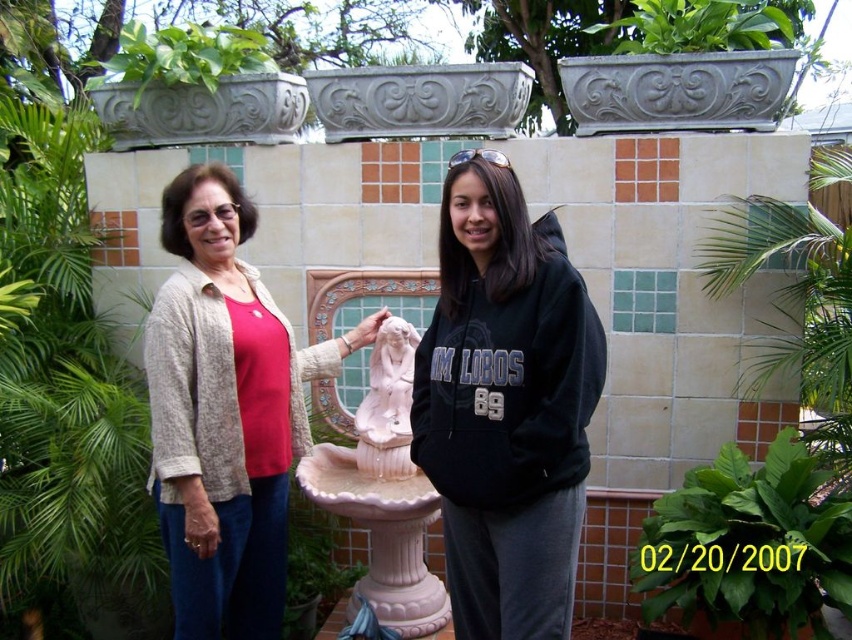
Question: Does green leafy plant at upper left have a smaller size compared to white marble statue at center?

Choices:
 (A) yes
 (B) no

Answer: (B)

Question: Can you confirm if black fleece sweatshirt at center is positioned to the left of matte beige cardigan at left?

Choices:
 (A) yes
 (B) no

Answer: (B)

Question: Which point is closer to the camera taking this photo?

Choices:
 (A) (250, 317)
 (B) (671, 496)

Answer: (A)

Question: Which point is farther from the camera taking this photo?

Choices:
 (A) 743,44
 (B) 233,49
 (C) 446,227
 (D) 400,365

Answer: (B)

Question: Does black fleece sweatshirt at center have a greater width compared to matte beige cardigan at left?

Choices:
 (A) yes
 (B) no

Answer: (B)

Question: Which of the following is the closest to the observer?

Choices:
 (A) green leafy plant at right
 (B) green leafy plant at lower right

Answer: (B)